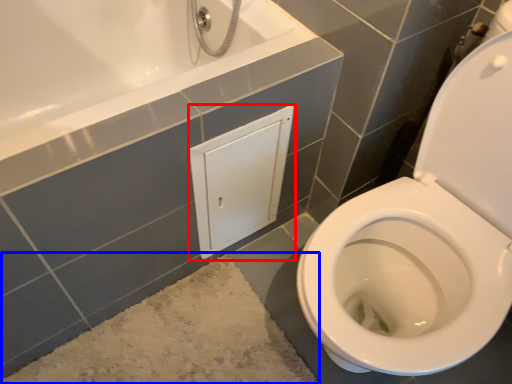
Question: Among these objects, which one is farthest to the camera, medicine cabinet (highlighted by a red box) or bath mat (highlighted by a blue box)?

Choices:
 (A) medicine cabinet
 (B) bath mat

Answer: (A)